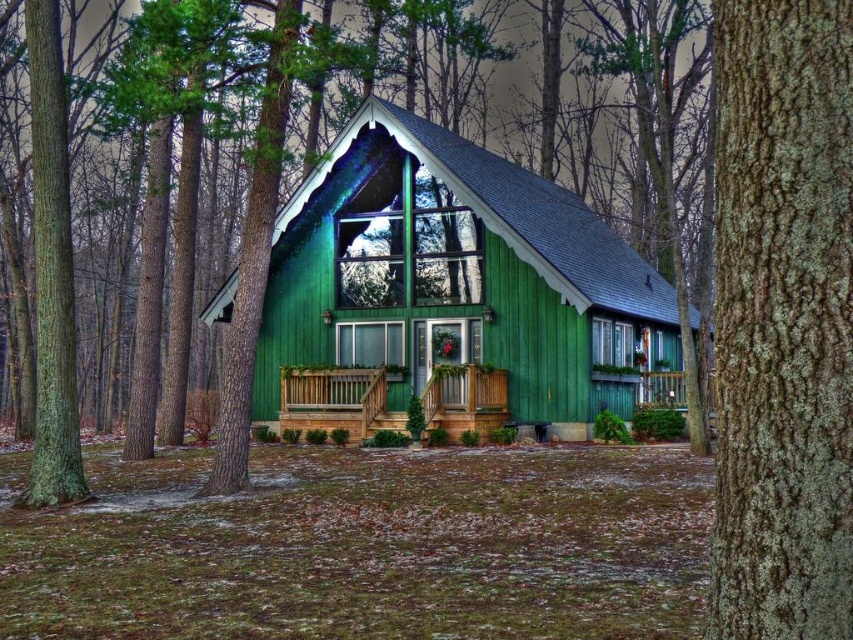
Is green rough bark tree at center to the right of wooden porch at center from the viewer's perspective?

Yes, green rough bark tree at center is to the right of wooden porch at center.

This screenshot has height=640, width=853. Describe the element at coordinates (436, 284) in the screenshot. I see `green rough bark tree at center` at that location.

From the picture: Measure the distance between point [518,256] and camera.

They are 27.11 meters apart.

Image resolution: width=853 pixels, height=640 pixels. Find the location of `green rough bark tree at center`. green rough bark tree at center is located at coordinates (436, 284).

Can you confirm if green wood cabin at center is taller than green lichen-covered tree trunk at right?

Correct, green wood cabin at center is much taller as green lichen-covered tree trunk at right.

Where is `green wood cabin at center`? The image size is (853, 640). green wood cabin at center is located at coordinates (450, 291).

Does green wood cabin at center come behind wooden porch at center?

No, green wood cabin at center is closer to the viewer.

Can you confirm if green wood cabin at center is positioned to the left of wooden porch at center?

In fact, green wood cabin at center is to the right of wooden porch at center.

Describe the element at coordinates (450, 291) in the screenshot. I see `green wood cabin at center` at that location.

Where is `green wood cabin at center`? green wood cabin at center is located at coordinates (450, 291).